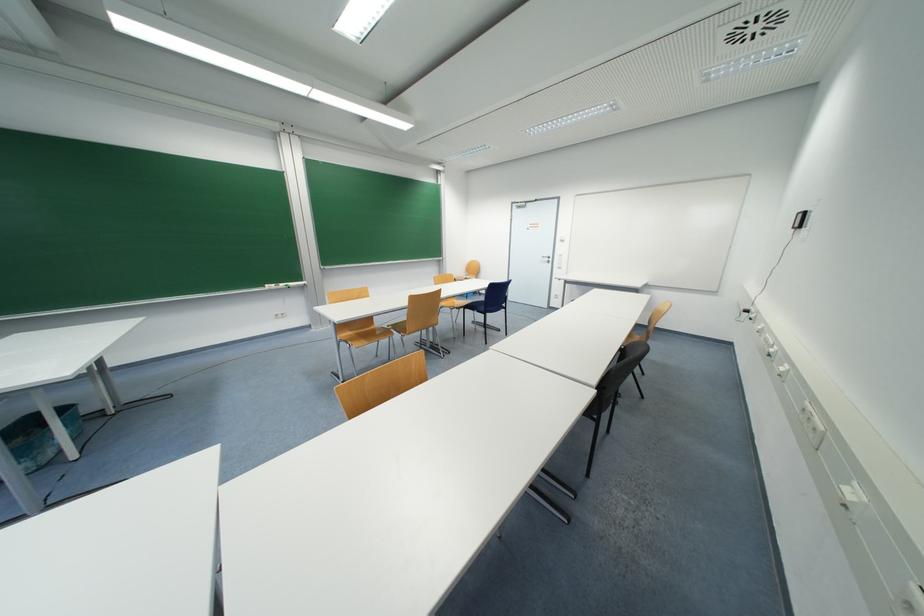
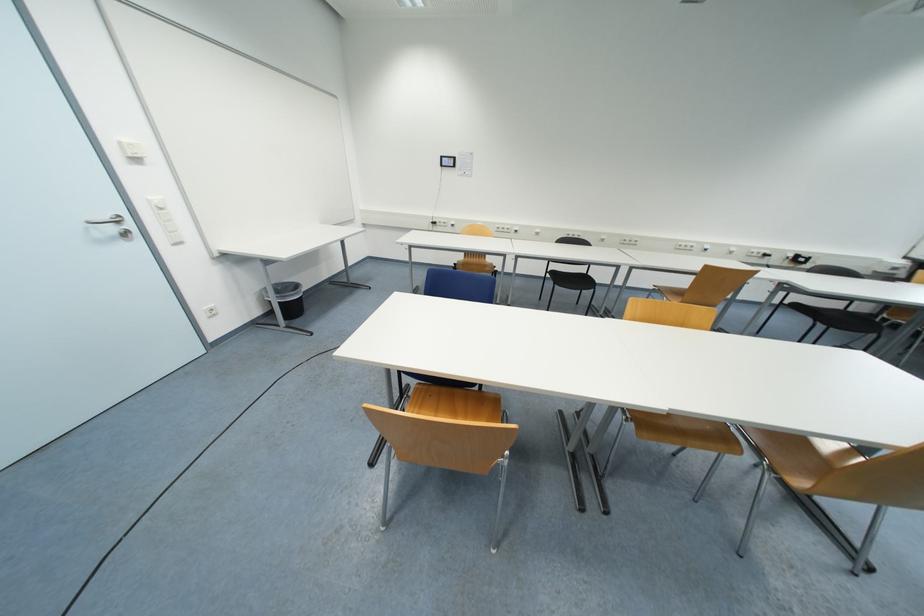
Question: I am providing you with two images of the same scene from different viewpoints. Which of the following objects are not visible in image2?

Choices:
 (A) silver door handle
 (B) blue chair sitting surface
 (C) white portable fan
 (D) black trash can

Answer: (B)